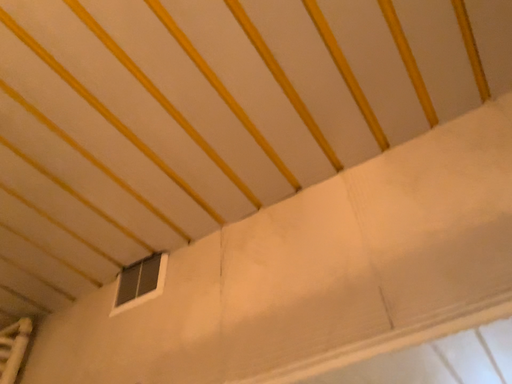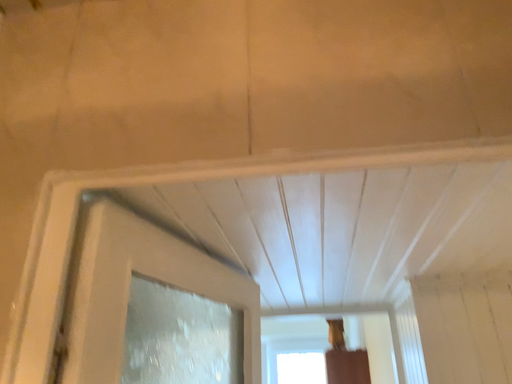
Question: How did the camera likely rotate when shooting the video?

Choices:
 (A) rotated downward
 (B) rotated upward

Answer: (A)